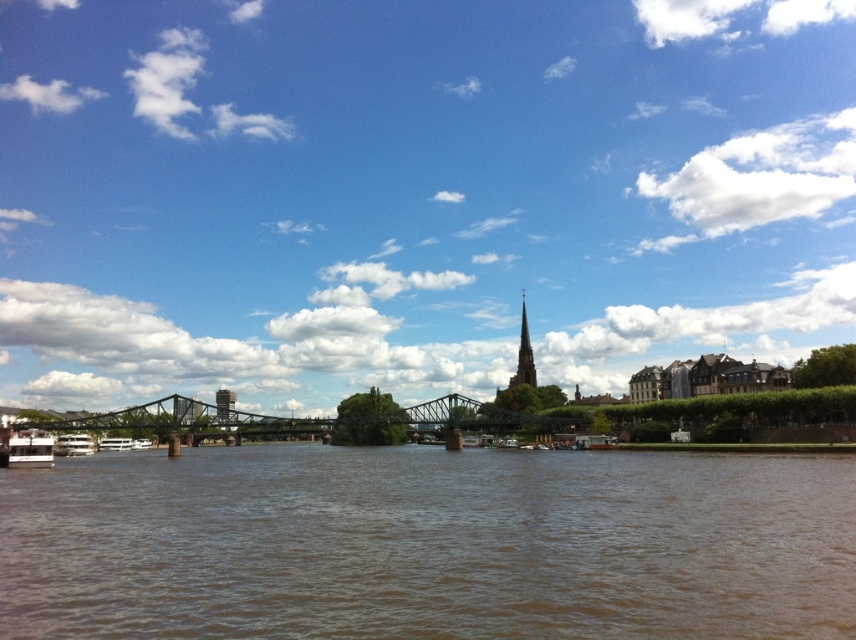
Question: Among these objects, which one is farthest from the camera?

Choices:
 (A) blue sky at upper center
 (B) metallic bridge at center
 (C) white glossy boat at lower left

Answer: (A)

Question: Which of the following is the farthest from the observer?

Choices:
 (A) (125, 144)
 (B) (64, 554)

Answer: (A)

Question: Does white glossy boat at lower left appear over white plastic boat at lower left?

Choices:
 (A) no
 (B) yes

Answer: (B)

Question: Is the position of blue sky at upper center more distant than that of white glossy boat at lower left?

Choices:
 (A) no
 (B) yes

Answer: (B)

Question: Is green stone spire at upper right smaller than metallic gray tower at left?

Choices:
 (A) no
 (B) yes

Answer: (B)

Question: Which object is farther from the camera taking this photo?

Choices:
 (A) white glossy boat at lower left
 (B) metallic bridge at center
 (C) green stone spire at upper right
 (D) blue sky at upper center

Answer: (C)